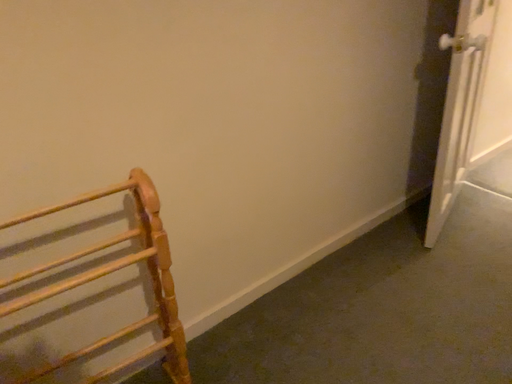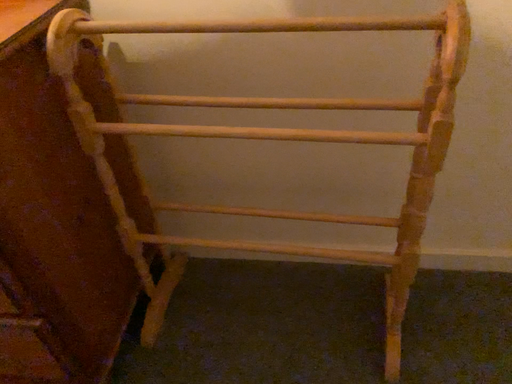
Question: Which way did the camera rotate in the video?

Choices:
 (A) rotated right
 (B) rotated left

Answer: (B)